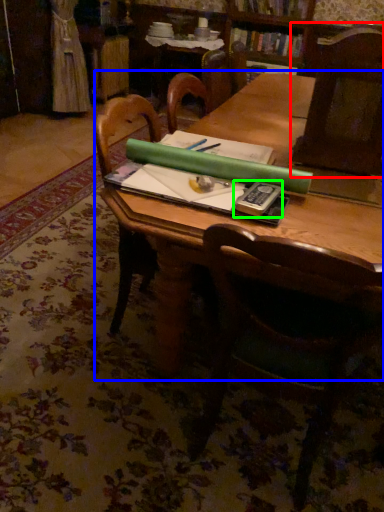
Question: Which object is the farthest from chair (highlighted by a red box)? Choose among these: table (highlighted by a blue box) or paperback book (highlighted by a green box).

Choices:
 (A) table
 (B) paperback book

Answer: (B)